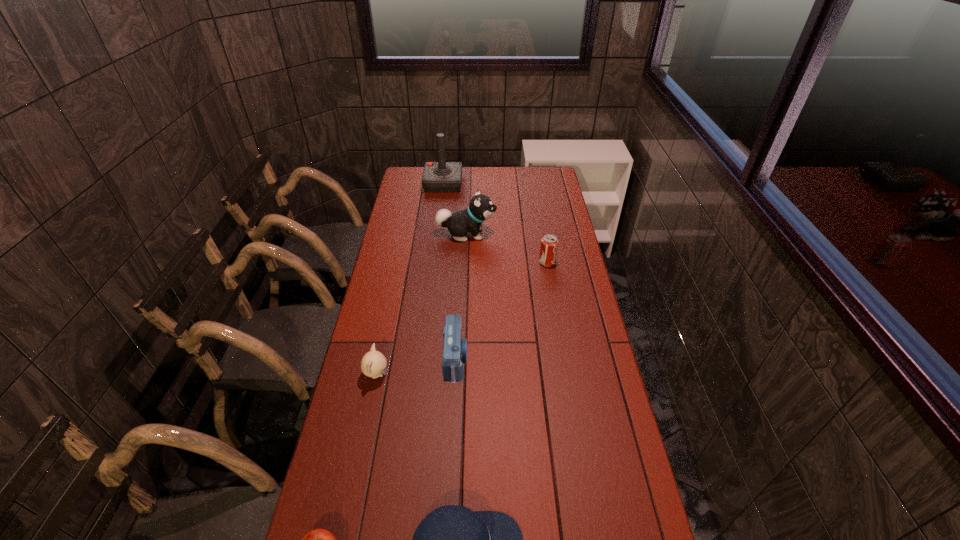
The width and height of the screenshot is (960, 540). Find the location of `free spot located 0.050m on the right of the third farthest object`. free spot located 0.050m on the right of the third farthest object is located at coordinates (567, 262).

Locate an element on the screen. vacant space situated on the lens of the camera is located at coordinates (560, 359).

Where is `free space located on the face of the kitten`? free space located on the face of the kitten is located at coordinates (433, 374).

Where is `object located at the far edge`? The image size is (960, 540). object located at the far edge is located at coordinates (438, 177).

At what (x,y) coordinates should I click in order to perform the action: click on joystick located in the left edge section of the desktop. Please return your answer as a coordinate pair (x, y). This screenshot has height=540, width=960. Looking at the image, I should click on (438, 177).

Where is `kitten present at the left edge`? Image resolution: width=960 pixels, height=540 pixels. kitten present at the left edge is located at coordinates (373, 364).

Locate an element on the screen. Image resolution: width=960 pixels, height=540 pixels. object located in the right edge section of the desktop is located at coordinates click(549, 243).

I want to click on object that is at the far left corner, so click(x=438, y=177).

You are a GUI agent. You are given a task and a screenshot of the screen. Output one action in this format:
    pyautogui.click(x=<x>, y=<y>)
    Task: Click on the vacant region at the far edge of the desktop
    The image size is (960, 540).
    Given the screenshot: What is the action you would take?
    pyautogui.click(x=479, y=181)

Find the location of `vacant space at the left edge of the desktop`. vacant space at the left edge of the desktop is located at coordinates (383, 396).